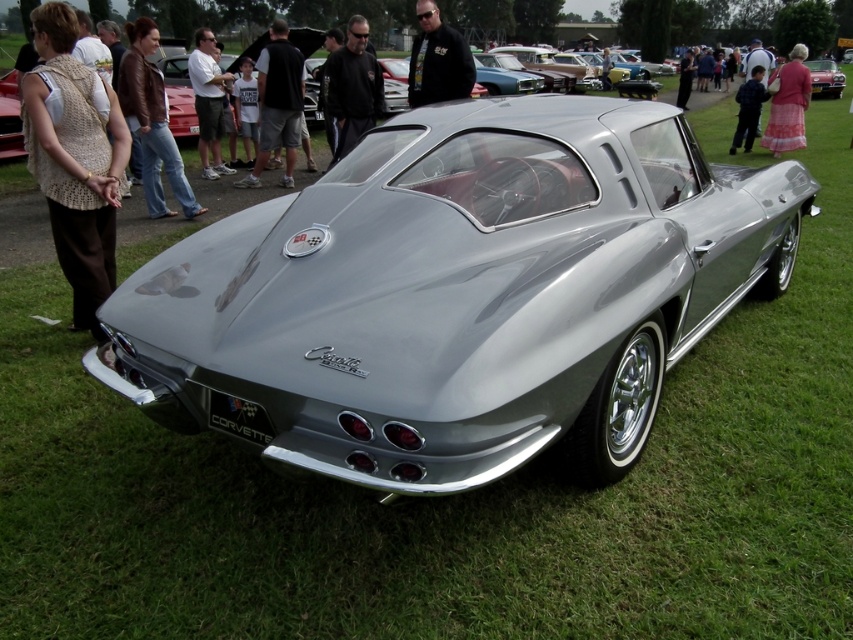
Describe the element at coordinates (151, 122) in the screenshot. I see `brown leather jacket at upper left` at that location.

Where is `brown leather jacket at upper left`? brown leather jacket at upper left is located at coordinates (151, 122).

Is black cotton t-shirt at center below silver metallic car at center?

Indeed, black cotton t-shirt at center is positioned under silver metallic car at center.

Between point (271, 26) and point (833, 97), which one is positioned in front?

Positioned in front is point (833, 97).

Does point (257, 177) lie in front of point (824, 90)?

That is True.

Locate an element on the screen. The width and height of the screenshot is (853, 640). black cotton t-shirt at center is located at coordinates (277, 102).

Is point (42, 83) farther from viewer compared to point (746, 136)?

No, (42, 83) is in front of (746, 136).

Can you confirm if knitted beige vest at left is taller than blue denim jeans at center?

Yes.

Does point (129, 138) come farther from viewer compared to point (749, 90)?

No, it is not.

The image size is (853, 640). Find the location of `knitted beige vest at left`. knitted beige vest at left is located at coordinates (74, 160).